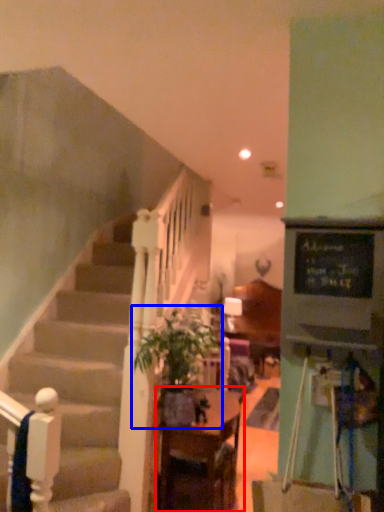
Question: Which of the following is the farthest to the observer, table (highlighted by a red box) or houseplant (highlighted by a blue box)?

Choices:
 (A) table
 (B) houseplant

Answer: (A)